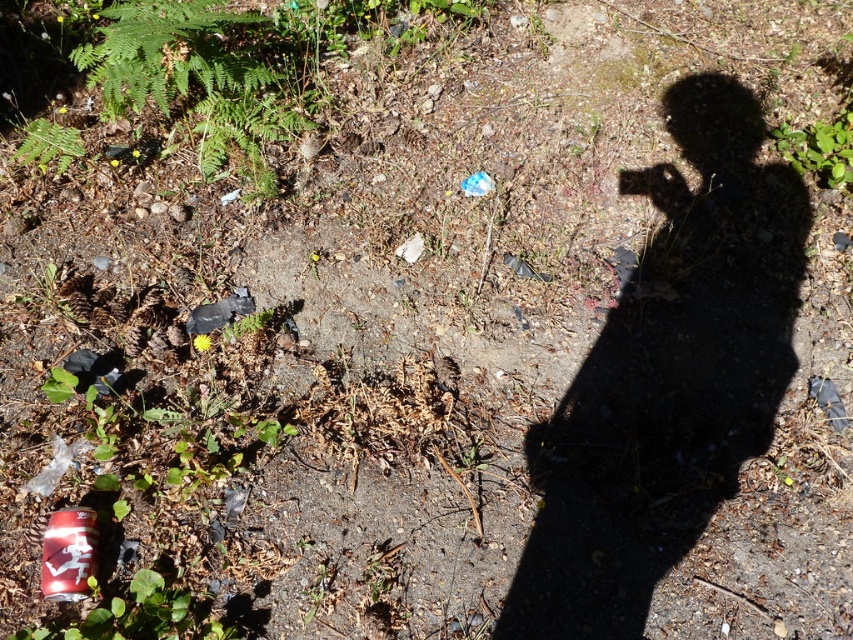
Does red matte can at bottom left have a smaller size compared to green leafy weed at upper right?

Yes, red matte can at bottom left is smaller than green leafy weed at upper right.

Does red matte can at bottom left have a larger size compared to green leafy weed at upper right?

Incorrect, red matte can at bottom left is not larger than green leafy weed at upper right.

Between point (49, 582) and point (837, 141), which one is positioned in front?

Positioned in front is point (49, 582).

Locate an element on the screen. The height and width of the screenshot is (640, 853). red matte can at bottom left is located at coordinates (68, 554).